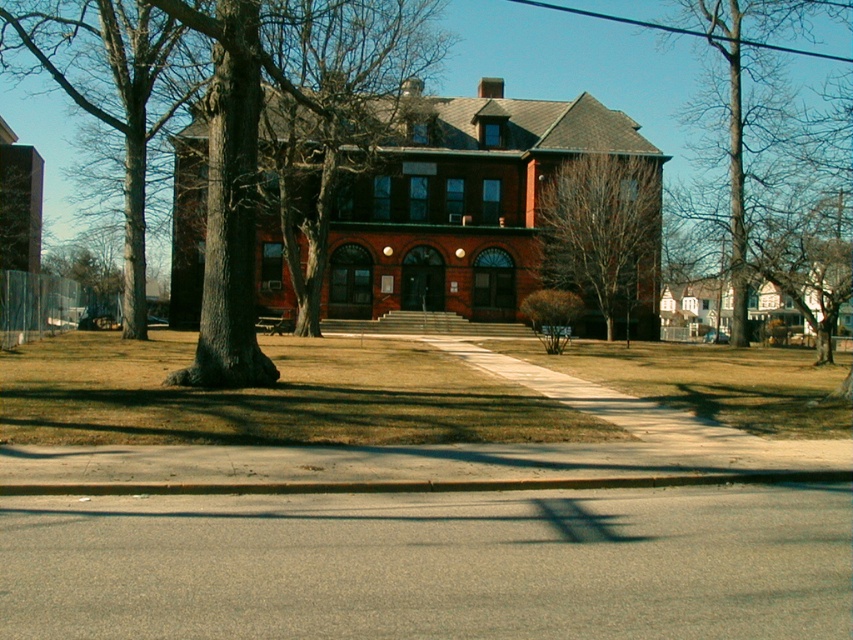
You are a pedestrian standing on the sidewalk in front of the building. You notice the dark brown bark tree at center and the bare branches at right. Which object is higher in the scene?

The dark brown bark tree at center is higher than the bare branches at right.

You are standing at the entrance of the building and want to walk to the point labeled point (602, 164). There is an obstacle at point labeled point (144, 13). Will you need to go around the obstacle to reach your destination?

Since point (144, 13) is in front of point (602, 164), you will need to go around the obstacle located at point (144, 13) to reach your destination.

You are a visitor approaching the building and want to know which object is bigger between the dark brown bark tree at center and the bare branches at right. Can you tell me?

The dark brown bark tree at center has a larger size compared to the bare branches at right, so the dark brown bark tree at center is bigger.